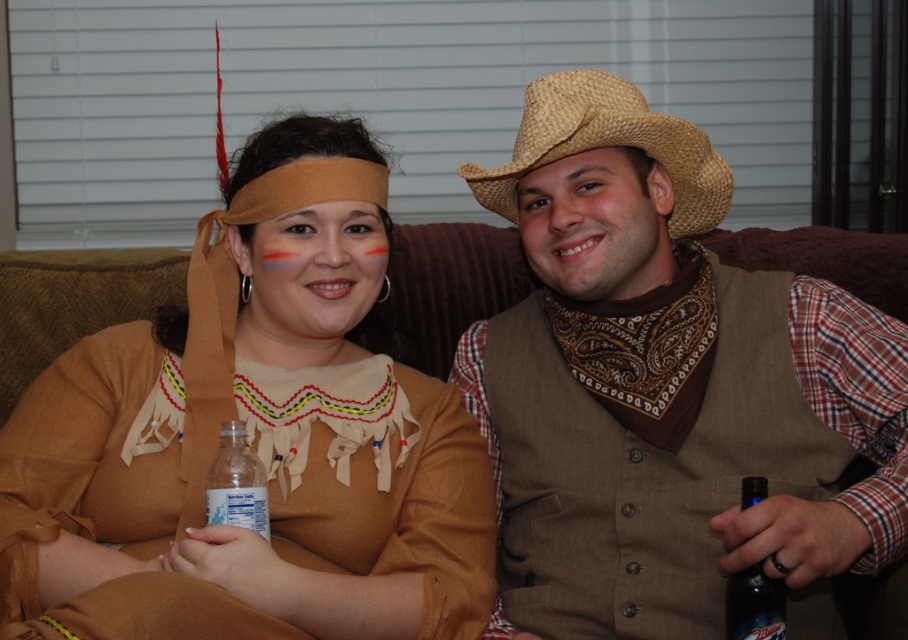
Question: Which point is farther to the camera?

Choices:
 (A) straw hat at right
 (B) clear plastic bottle at center
 (C) blue glass beer bottle at lower right
 (D) matte brown cowboy hat at upper right

Answer: (D)

Question: Which point is closer to the camera taking this photo?

Choices:
 (A) (227, 500)
 (B) (637, 182)

Answer: (A)

Question: From the image, what is the correct spatial relationship of brown woven cowboy hat at upper right in relation to matte straw hat at upper right?

Choices:
 (A) left
 (B) right

Answer: (B)

Question: Which point appears farthest from the camera in this image?

Choices:
 (A) (443, 420)
 (B) (331, 276)

Answer: (A)

Question: Can you confirm if clear plastic bottle at center is bigger than blue glass beer bottle at lower right?

Choices:
 (A) yes
 (B) no

Answer: (B)

Question: Can you confirm if brown woven cowboy hat at upper right is positioned below matte brown dress at center?

Choices:
 (A) no
 (B) yes

Answer: (A)